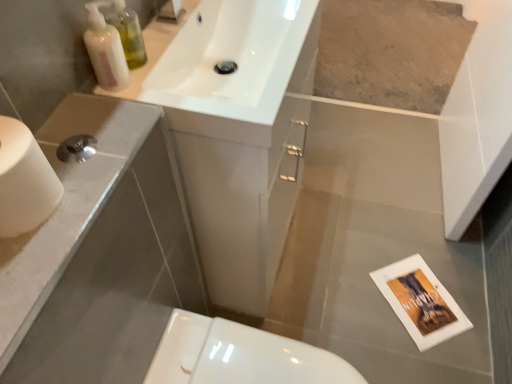
Question: Is point [x=257, y=375] closer or farther from the camera than point [x=3, y=117]?

Choices:
 (A) closer
 (B) farther

Answer: (B)

Question: From the image's perspective, is white glossy toilet at lower center above or below white matte toilet paper at left?

Choices:
 (A) below
 (B) above

Answer: (A)

Question: Which object is positioned closest to the white glossy soap dispenser at upper left?

Choices:
 (A) white glossy sink at upper center
 (B) white glossy toilet at lower center
 (C) translucent plastic bottles at upper left
 (D) white matte toilet paper at left

Answer: (C)

Question: Which of these objects is positioned farthest from the translucent plastic bottles at upper left?

Choices:
 (A) white glossy soap dispenser at upper left
 (B) white glossy sink at upper center
 (C) white glossy toilet at lower center
 (D) white matte toilet paper at left

Answer: (C)